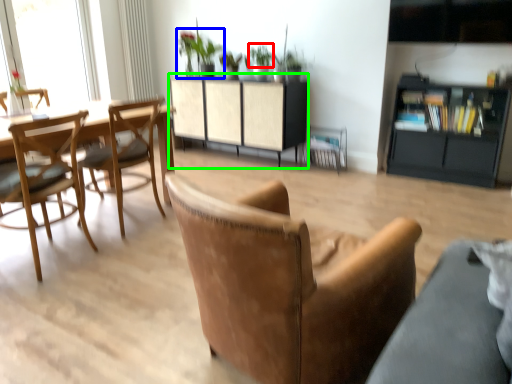
Question: Which object is positioned closest to plant (highlighted by a red box)? Select from houseplant (highlighted by a blue box) and cabinetry (highlighted by a green box).

Choices:
 (A) houseplant
 (B) cabinetry

Answer: (A)